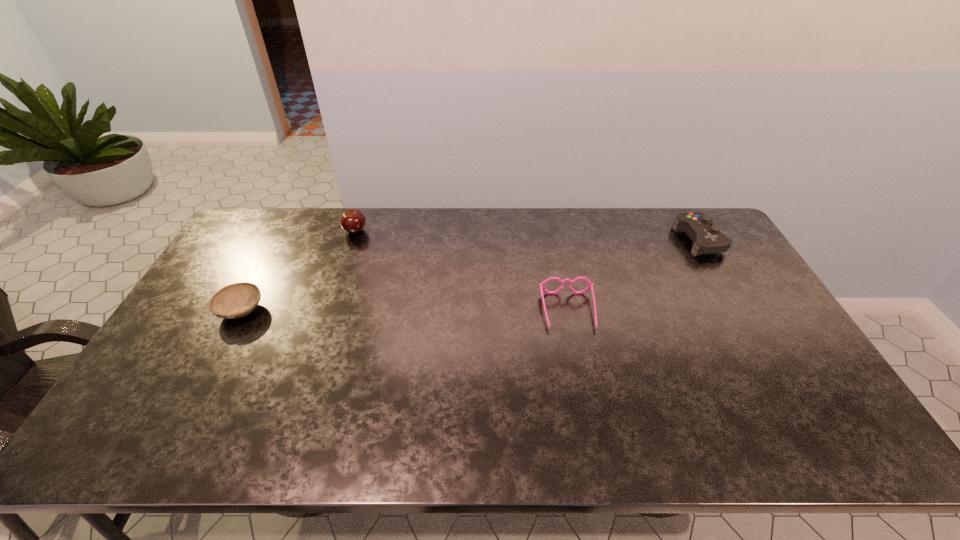
Identify the location of apple at the far edge. This screenshot has width=960, height=540. (352, 221).

The height and width of the screenshot is (540, 960). Identify the location of control located in the far edge section of the desktop. (706, 238).

The height and width of the screenshot is (540, 960). Identify the location of object that is at the left edge. (234, 301).

Locate an element on the screen. The width and height of the screenshot is (960, 540). object present at the right edge is located at coordinates (706, 238).

Where is `object situated at the far right corner`? object situated at the far right corner is located at coordinates (706, 238).

Locate an element on the screen. The image size is (960, 540). vacant space at the far edge of the desktop is located at coordinates (666, 239).

In the image, there is a desktop. What are the coordinates of `free region at the near edge` in the screenshot? It's located at (377, 443).

Identify the location of vacant space at the left edge. (164, 397).

In the image, there is a desktop. Where is `free space at the right edge`? free space at the right edge is located at coordinates (697, 268).

I want to click on vacant space that is in between the leftmost object and the control, so click(470, 275).